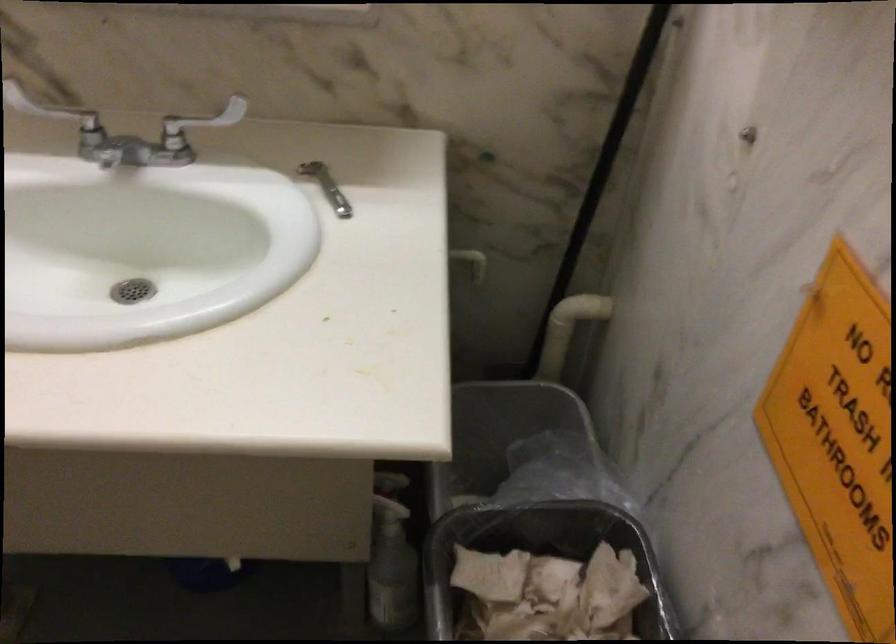
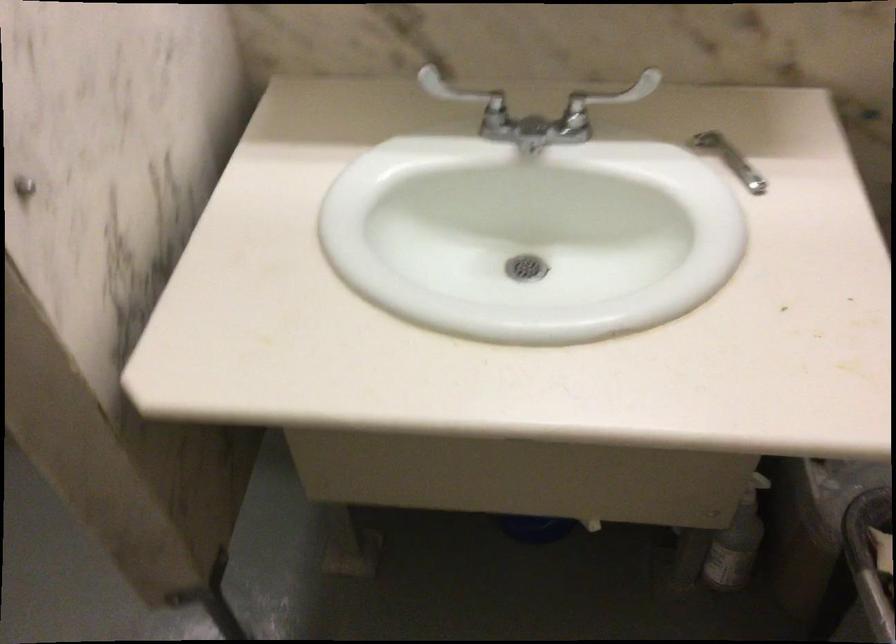
The point at (324, 187) is marked in the first image. Where is the corresponding point in the second image?

(729, 158)